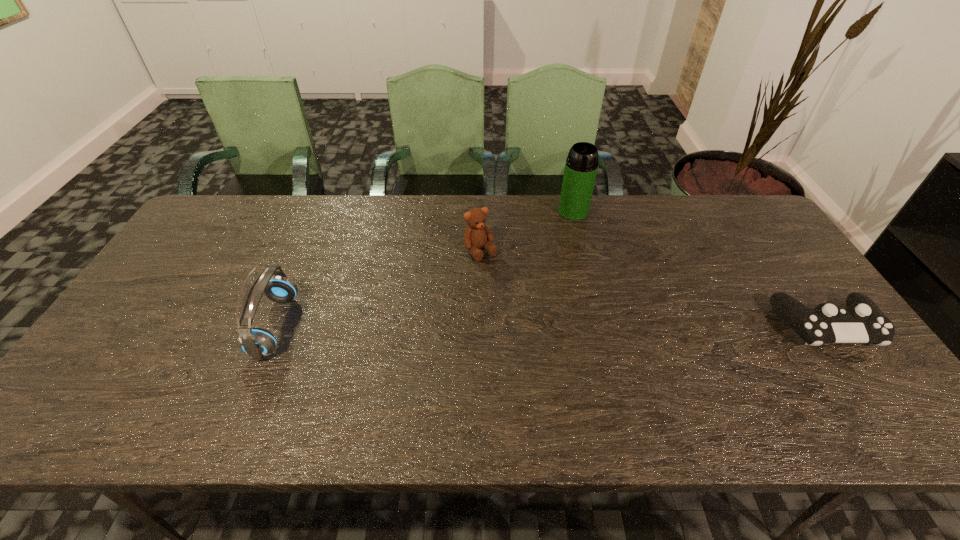
Identify the location of vacant space located 0.380m on the face of the third nearest object. (560, 357).

I want to click on vacant space located on the face of the third nearest object, so click(x=563, y=360).

Find the location of `vacant space situated 0.080m on the face of the third nearest object`. vacant space situated 0.080m on the face of the third nearest object is located at coordinates (501, 279).

Find the location of a particular element. free space located from the spout of the farthest object is located at coordinates (580, 299).

Identify the location of blank space located 0.110m from the spout of the farthest object. The width and height of the screenshot is (960, 540). (576, 242).

Image resolution: width=960 pixels, height=540 pixels. Find the location of `free spot located from the spout of the farthest object`. free spot located from the spout of the farthest object is located at coordinates (578, 271).

Where is `teddy bear that is at the far edge`? The width and height of the screenshot is (960, 540). teddy bear that is at the far edge is located at coordinates (477, 234).

The image size is (960, 540). I want to click on thermos bottle at the far edge, so click(x=581, y=165).

Image resolution: width=960 pixels, height=540 pixels. Identify the location of object present at the near edge. (256, 342).

The height and width of the screenshot is (540, 960). I want to click on object positioned at the right edge, so click(862, 321).